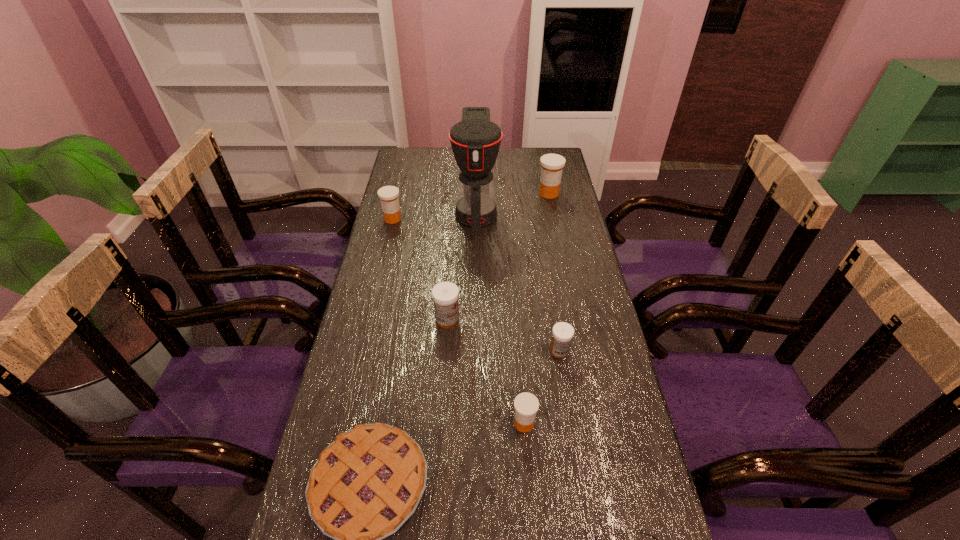
Identify the location of the tallest object. The height and width of the screenshot is (540, 960). (475, 141).

The height and width of the screenshot is (540, 960). Find the location of `the farthest orange medicine`. the farthest orange medicine is located at coordinates (552, 165).

Where is `the tallest medicine`? the tallest medicine is located at coordinates (552, 165).

Identify the location of the bigger white medicine. Image resolution: width=960 pixels, height=540 pixels. (445, 295).

At what (x,y) coordinates should I click in order to perform the action: click on the second medicine from left to right. Please return your answer as a coordinate pair (x, y). This screenshot has width=960, height=540. Looking at the image, I should click on (445, 295).

Locate an element on the screen. the second smallest orange medicine is located at coordinates (388, 195).

In order to click on the fourth nearest medicine in this screenshot , I will do `click(388, 195)`.

Locate an element on the screen. This screenshot has height=540, width=960. the nearer white medicine is located at coordinates (562, 333).

The height and width of the screenshot is (540, 960). Identify the location of the second nearest medicine. (562, 333).

Find the location of `the third medicine from left to right`. the third medicine from left to right is located at coordinates (526, 405).